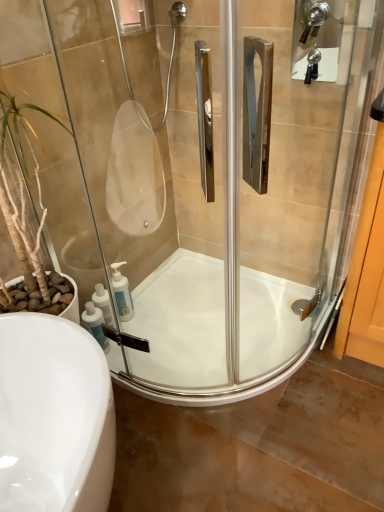
Question: Is there a large distance between white plastic soap dispenser at lower left, which is the 1th soap dispenser in front-to-back order, and white glossy bath at center?

Choices:
 (A) yes
 (B) no

Answer: (B)

Question: Is white plastic soap dispenser at lower left, which is the 1th soap dispenser in front-to-back order, smaller than white glossy bath at center?

Choices:
 (A) yes
 (B) no

Answer: (A)

Question: From the image's perspective, is white plastic soap dispenser at lower left, which is the 1th soap dispenser in front-to-back order, over white glossy bath at center?

Choices:
 (A) no
 (B) yes

Answer: (B)

Question: From a real-world perspective, does white plastic soap dispenser at lower left, which is the 1th soap dispenser in front-to-back order, stand above white glossy bath at center?

Choices:
 (A) no
 (B) yes

Answer: (B)

Question: Is white plastic soap dispenser at lower left, which is the second soap dispenser in back-to-front order, oriented towards white glossy bath at center?

Choices:
 (A) no
 (B) yes

Answer: (A)

Question: Does point (100, 320) appear closer or farther from the camera than point (155, 269)?

Choices:
 (A) closer
 (B) farther

Answer: (A)

Question: Which is correct: white plastic soap dispenser at lower left, which is the second soap dispenser in back-to-front order, is inside white glossy bath at center, or outside of it?

Choices:
 (A) inside
 (B) outside

Answer: (B)

Question: From a real-world perspective, is white plastic soap dispenser at lower left, which is the 1th soap dispenser in front-to-back order, physically located above or below white glossy bath at center?

Choices:
 (A) below
 (B) above

Answer: (B)

Question: Relative to white glossy bath at center, is white plastic soap dispenser at lower left, which is the 1th soap dispenser in front-to-back order, in front or behind?

Choices:
 (A) behind
 (B) front

Answer: (A)

Question: Considering the positions of white plastic soap dispenser at lower left, acting as the second soap dispenser starting from the front, and satin nickel faucet at upper right in the image, is white plastic soap dispenser at lower left, acting as the second soap dispenser starting from the front, taller or shorter than satin nickel faucet at upper right?

Choices:
 (A) tall
 (B) short

Answer: (B)

Question: Is white plastic soap dispenser at lower left, acting as the second soap dispenser starting from the front, wider or thinner than satin nickel faucet at upper right?

Choices:
 (A) wide
 (B) thin

Answer: (B)

Question: Would you say white plastic soap dispenser at lower left, the first soap dispenser from the back, is to the left or to the right of satin nickel faucet at upper right in the picture?

Choices:
 (A) left
 (B) right

Answer: (A)

Question: Would you say white plastic soap dispenser at lower left, the first soap dispenser from the back, is inside or outside satin nickel faucet at upper right?

Choices:
 (A) inside
 (B) outside

Answer: (B)

Question: Considering the relative positions of satin nickel faucet at upper right and white glossy bath at center in the image provided, is satin nickel faucet at upper right to the left or to the right of white glossy bath at center?

Choices:
 (A) right
 (B) left

Answer: (A)

Question: Looking at their shapes, would you say satin nickel faucet at upper right is wider or thinner than white glossy bath at center?

Choices:
 (A) wide
 (B) thin

Answer: (B)